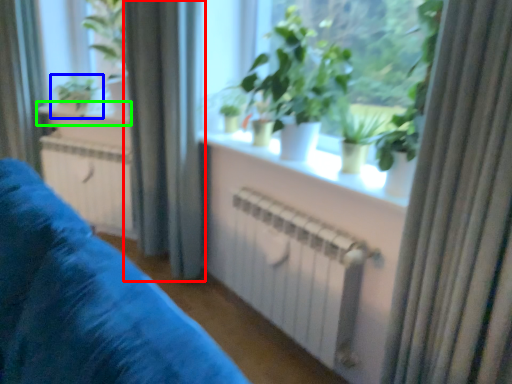
Question: Considering the real-world distances, which object is closest to curtain (highlighted by a red box)? houseplant (highlighted by a blue box) or window sill (highlighted by a green box).

Choices:
 (A) houseplant
 (B) window sill

Answer: (B)